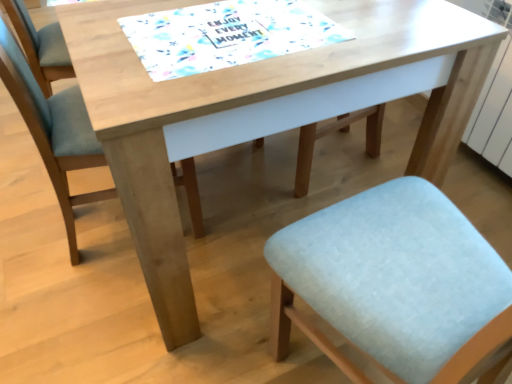
Identify the location of free spot below white paper placemat at center (from a real-world perspective). Image resolution: width=512 pixels, height=384 pixels. (240, 28).